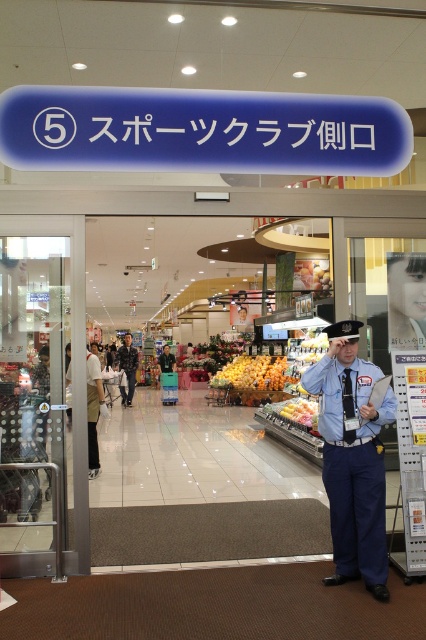
Is blue uniform at center thinner than yellow matte apples at center?

In fact, blue uniform at center might be wider than yellow matte apples at center.

Can you confirm if blue uniform at center is wider than yellow matte apples at center?

Indeed, blue uniform at center has a greater width compared to yellow matte apples at center.

Locate an element on the screen. Image resolution: width=426 pixels, height=640 pixels. blue uniform at center is located at coordinates (353, 458).

Identify the location of blue uniform at center. The image size is (426, 640). (353, 458).

Does blue uniform at center appear on the left side of blue uniform at left?

Incorrect, blue uniform at center is not on the left side of blue uniform at left.

Who is positioned more to the left, blue uniform at center or blue uniform at left?

blue uniform at left

Locate an element on the screen. blue uniform at center is located at coordinates (353, 458).

Between glossy orange fruits at center and camouflage fabric uniform at center, which one appears on the right side from the viewer's perspective?

From the viewer's perspective, glossy orange fruits at center appears more on the right side.

Is point (256, 385) positioned after point (120, 365)?

No, it is not.

Identify the location of glossy orange fruits at center. (253, 372).

Identify the location of glossy orange fruits at center. (x=253, y=372).